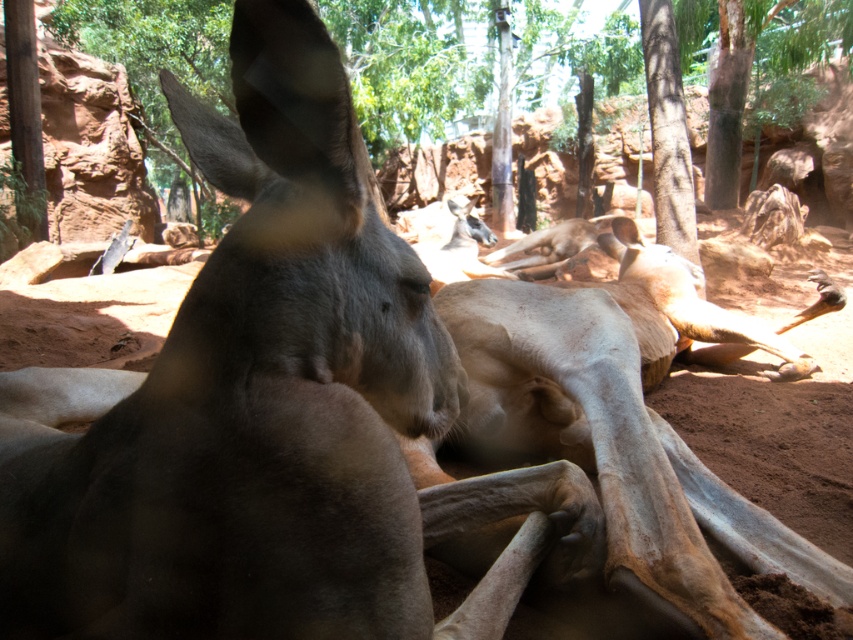
Question: Does brown fur kangaroo at center appear on the left side of brown rough tree at upper center?

Choices:
 (A) yes
 (B) no

Answer: (A)

Question: Which point is closer to the camera taking this photo?

Choices:
 (A) (206, 88)
 (B) (368, 577)

Answer: (B)

Question: Is the position of brown fur kangaroo at center less distant than that of brown rough tree at upper center?

Choices:
 (A) no
 (B) yes

Answer: (B)

Question: Is brown fur kangaroo at center below brown rough tree at upper center?

Choices:
 (A) yes
 (B) no

Answer: (A)

Question: Which point is farther to the camera?

Choices:
 (A) brown rough tree at upper center
 (B) brown fur kangaroo at center

Answer: (A)